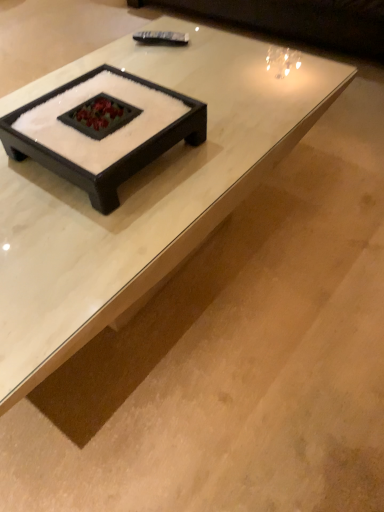
Question: Is dark brown leather couch at upper center situated inside white glossy coffee table at center or outside?

Choices:
 (A) inside
 (B) outside

Answer: (B)

Question: From the image's perspective, relative to white glossy coffee table at center, is dark brown leather couch at upper center above or below?

Choices:
 (A) below
 (B) above

Answer: (B)

Question: Is point (360, 25) positioned closer to the camera than point (286, 106)?

Choices:
 (A) farther
 (B) closer

Answer: (A)

Question: From their relative heights in the image, would you say white glossy coffee table at center is taller or shorter than dark brown leather couch at upper center?

Choices:
 (A) tall
 (B) short

Answer: (A)

Question: Looking at the image, does white glossy coffee table at center seem bigger or smaller compared to dark brown leather couch at upper center?

Choices:
 (A) small
 (B) big

Answer: (A)

Question: In the image, is white glossy coffee table at center on the left side or the right side of dark brown leather couch at upper center?

Choices:
 (A) right
 (B) left

Answer: (B)

Question: In the image, is white glossy coffee table at center positioned in front of or behind dark brown leather couch at upper center?

Choices:
 (A) behind
 (B) front

Answer: (B)